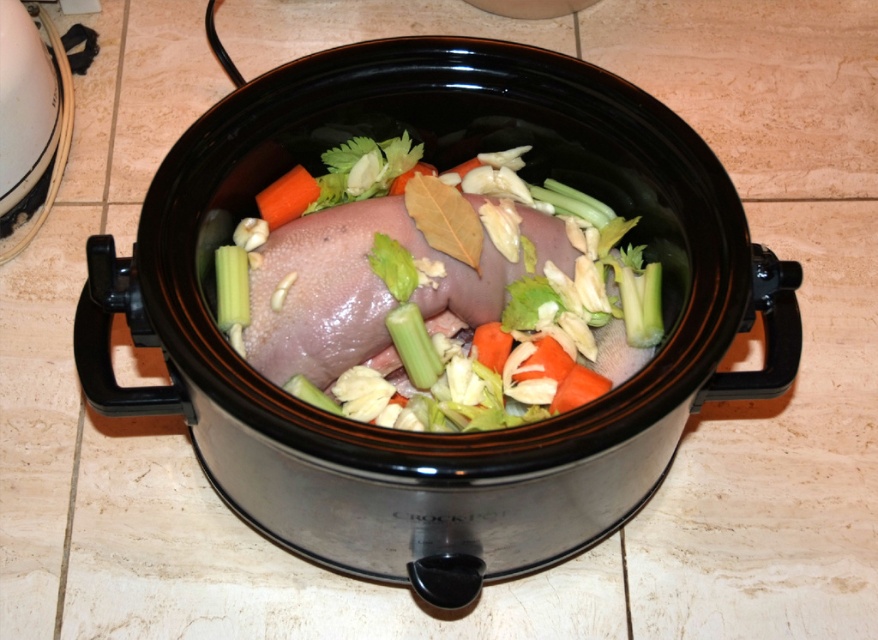
Which of these two, pink raw meat at center or orange smooth carrot at center, stands taller?

pink raw meat at center

Is point (432, 330) positioned after point (282, 196)?

No, it is in front of (282, 196).

Looking at this image, who is more forward, (619, 289) or (299, 189)?

Point (619, 289)

The width and height of the screenshot is (878, 640). Find the location of `pink raw meat at center`. pink raw meat at center is located at coordinates (436, 296).